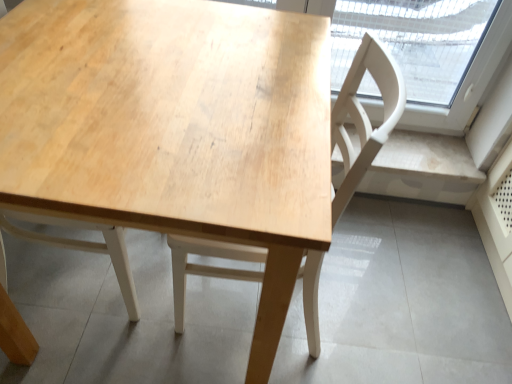
Where is `empty space that is to the right of light wood chair at center`? This screenshot has width=512, height=384. empty space that is to the right of light wood chair at center is located at coordinates (377, 302).